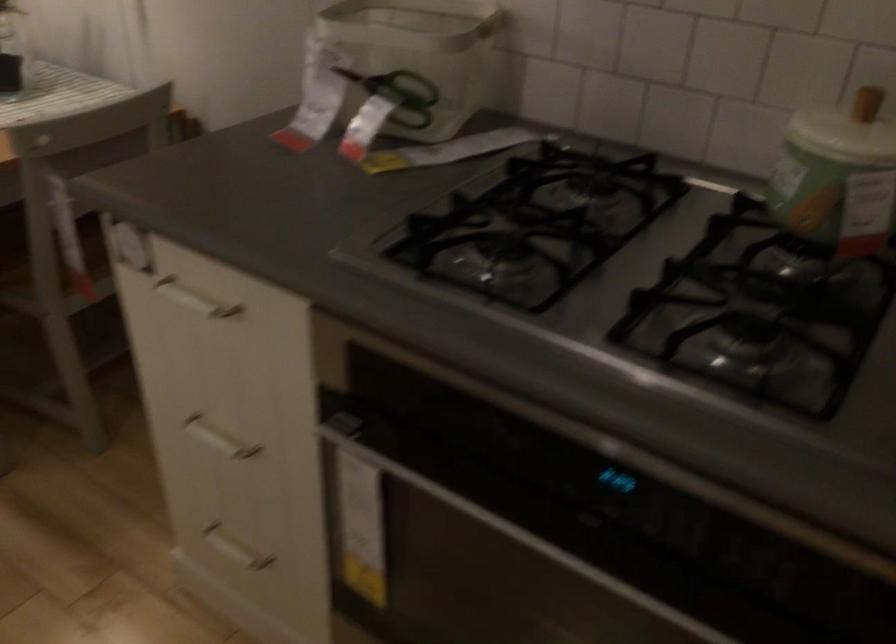
Where would you sit the chair sitting surface? Please return your answer as a coordinate pair (x, y).

(54, 270)